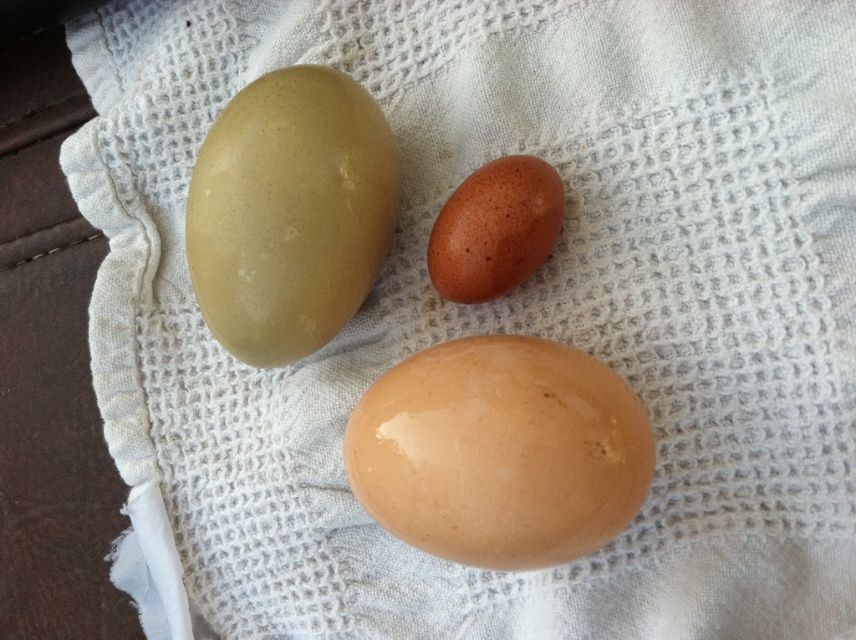
Between glossy brown egg at center and matte brown egg at upper left, which one has less height?

Standing shorter between the two is glossy brown egg at center.

Is glossy brown egg at center positioned at the back of matte brown egg at upper left?

No, glossy brown egg at center is closer to the viewer.

From the picture: Who is more distant from viewer, (518, 364) or (378, 257)?

Point (378, 257)

The width and height of the screenshot is (856, 640). In order to click on glossy brown egg at center in this screenshot , I will do `click(500, 452)`.

Measure the distance from glossy brown egg at center to speckled brown egg at center.

The distance of glossy brown egg at center from speckled brown egg at center is 7.53 inches.

Does point (360, 440) come closer to viewer compared to point (449, 300)?

Yes, it is.

This screenshot has height=640, width=856. Describe the element at coordinates (500, 452) in the screenshot. I see `glossy brown egg at center` at that location.

The height and width of the screenshot is (640, 856). In order to click on glossy brown egg at center in this screenshot , I will do `click(500, 452)`.

Between matte brown egg at upper left and speckled brown egg at center, which one is positioned lower?

speckled brown egg at center is below.

Does point (266, 179) lie behind point (458, 252)?

No, (266, 179) is in front of (458, 252).

Which is in front, point (247, 134) or point (486, 280)?

Point (247, 134) is in front.

Where is `matte brown egg at upper left`? Image resolution: width=856 pixels, height=640 pixels. matte brown egg at upper left is located at coordinates (290, 212).